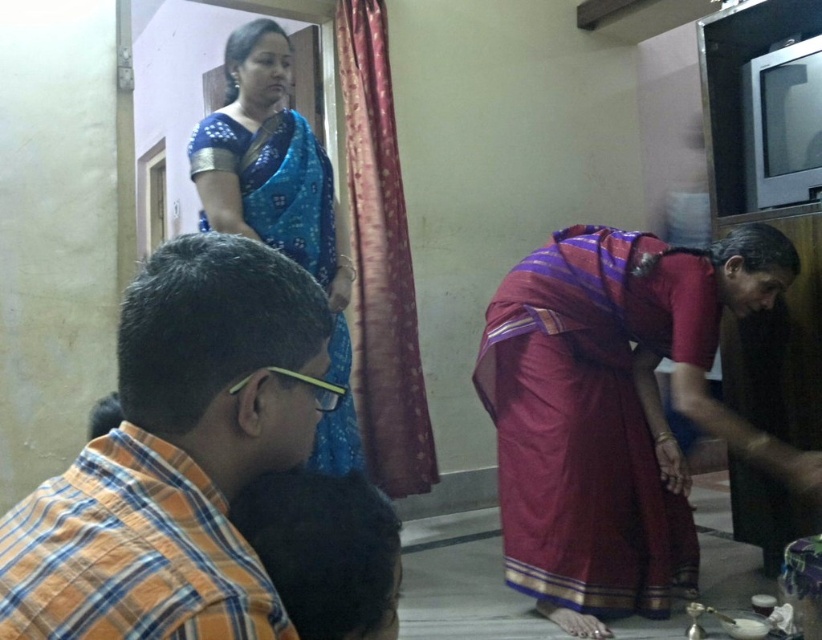
Question: Which point appears closest to the camera in this image?

Choices:
 (A) (483, 332)
 (B) (211, 422)

Answer: (B)

Question: Can you confirm if maroon silk saree at lower center is positioned to the right of plaid cotton shirt at lower left?

Choices:
 (A) no
 (B) yes

Answer: (B)

Question: Can you confirm if maroon silk saree at lower center is positioned to the right of plaid cotton shirt at lower left?

Choices:
 (A) no
 (B) yes

Answer: (B)

Question: Is the position of orange plaid shirt at lower left more distant than that of maroon silk saree at lower center?

Choices:
 (A) no
 (B) yes

Answer: (A)

Question: Which point appears farthest from the camera in this image?

Choices:
 (A) (254, 193)
 (B) (224, 513)
 (C) (580, 444)

Answer: (C)

Question: Which of the following is the farthest from the observer?

Choices:
 (A) orange plaid shirt at lower left
 (B) blue silk saree at upper left

Answer: (B)